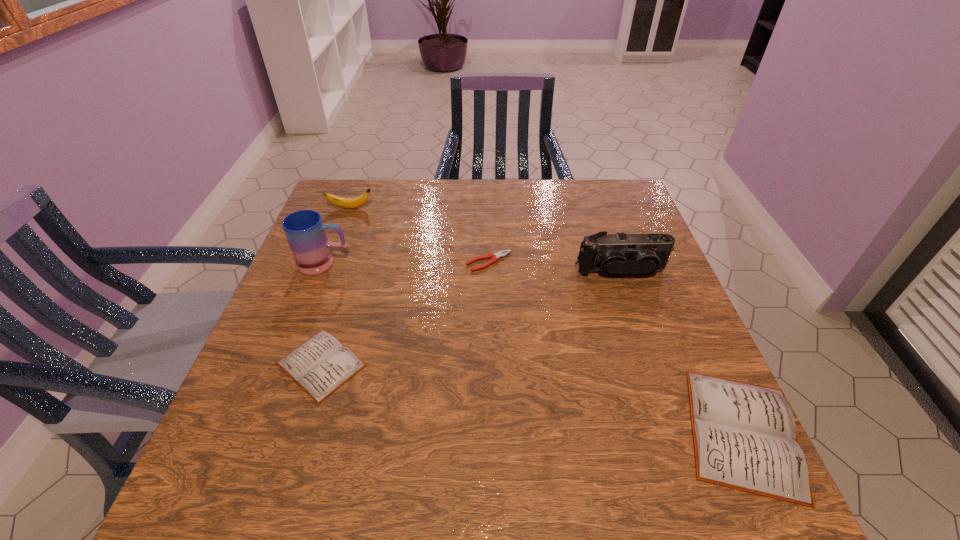
You are a GUI agent. You are given a task and a screenshot of the screen. Output one action in this format:
    pyautogui.click(x=<x>, y=<y>)
    Task: Click on the diary that is positioned at the right edge
    
    Given the screenshot: What is the action you would take?
    pyautogui.click(x=744, y=437)

Locate an element on the screen. The height and width of the screenshot is (540, 960). camcorder that is at the right edge is located at coordinates (643, 254).

You are a GUI agent. You are given a task and a screenshot of the screen. Output one action in this format:
    pyautogui.click(x=<x>, y=<y>)
    Task: Click on the object that is positioned at the far left corner
    The height and width of the screenshot is (540, 960).
    Given the screenshot: What is the action you would take?
    pos(349,203)

Find the location of a particular element. object present at the near left corner is located at coordinates (320, 365).

Locate an element on the screen. The image size is (960, 540). object that is positioned at the near right corner is located at coordinates (744, 437).

In the image, there is a desktop. Identify the location of free region at the far edge. Image resolution: width=960 pixels, height=540 pixels. pyautogui.click(x=413, y=187).

Locate an element on the screen. vacant area at the near edge is located at coordinates (366, 446).

Locate an element on the screen. vacant space at the left edge is located at coordinates (309, 298).

Locate an element on the screen. This screenshot has width=960, height=540. vacant space at the right edge is located at coordinates (629, 326).

This screenshot has height=540, width=960. In the image, there is a desktop. Find the location of `free space at the far left corner`. free space at the far left corner is located at coordinates (324, 206).